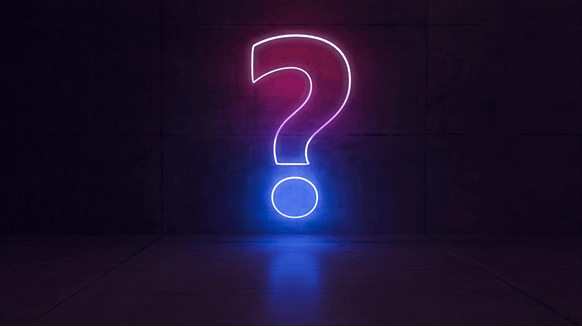
Find the location of a particular element. The width and height of the screenshot is (582, 327). seam in floor is located at coordinates [94, 288].